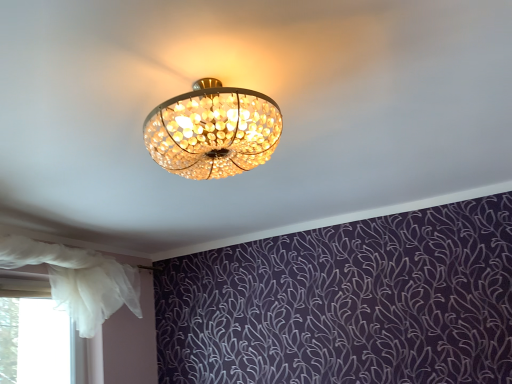
In order to face white sheer curtain at lower left, should I rotate leftwards or rightwards?

To face it directly, rotate left by 26.393 degrees.

Describe the element at coordinates (34, 342) in the screenshot. This screenshot has height=384, width=512. I see `white sheer curtain at lower left` at that location.

The image size is (512, 384). What are the coordinates of `white sheer curtain at lower left` in the screenshot? It's located at (34, 342).

Describe the element at coordinates (78, 280) in the screenshot. The image size is (512, 384). I see `white sheer curtain at left` at that location.

Locate an element on the screen. white sheer curtain at left is located at coordinates (78, 280).

What is the approximate height of white sheer curtain at left?

white sheer curtain at left is 27.05 inches tall.

Where is `white sheer curtain at lower left`? The height and width of the screenshot is (384, 512). white sheer curtain at lower left is located at coordinates (34, 342).

Is white sheer curtain at lower left at the right side of white sheer curtain at left?

In fact, white sheer curtain at lower left is to the left of white sheer curtain at left.

Which is behind, white sheer curtain at lower left or white sheer curtain at left?

white sheer curtain at lower left is further away from the camera.

Between point (56, 314) and point (83, 251), which one is positioned in front?

The point (83, 251) is closer.

From the image's perspective, is white sheer curtain at lower left over white sheer curtain at left?

No, from the image's perspective, white sheer curtain at lower left is not above white sheer curtain at left.

From a real-world perspective, which object stands above the other?

white sheer curtain at left, from a real-world perspective.

Considering the relative sizes of white sheer curtain at lower left and white sheer curtain at left in the image provided, is white sheer curtain at lower left wider than white sheer curtain at left?

In fact, white sheer curtain at lower left might be narrower than white sheer curtain at left.

Considering the sizes of objects white sheer curtain at lower left and white sheer curtain at left in the image provided, who is taller, white sheer curtain at lower left or white sheer curtain at left?

white sheer curtain at lower left is taller.

Based on the photo, does white sheer curtain at lower left have a smaller size compared to white sheer curtain at left?

Yes.

Would you say white sheer curtain at lower left is outside white sheer curtain at left?

Absolutely, white sheer curtain at lower left is external to white sheer curtain at left.

Is white sheer curtain at lower left not near white sheer curtain at left?

No, white sheer curtain at lower left is in close proximity to white sheer curtain at left.

Is white sheer curtain at lower left looking in the opposite direction of white sheer curtain at left?

white sheer curtain at lower left does not have its back to white sheer curtain at left.

Locate an element on the screen. The height and width of the screenshot is (384, 512). curtain in front of the white sheer curtain at lower left is located at coordinates (78, 280).

Which is more to the right, white sheer curtain at left or white sheer curtain at lower left?

Positioned to the right is white sheer curtain at left.

Which object is more forward, white sheer curtain at left or white sheer curtain at lower left?

white sheer curtain at left.

Considering the points (133, 278) and (13, 320), which point is in front, point (133, 278) or point (13, 320)?

The point (13, 320) is in front.

From the image's perspective, would you say white sheer curtain at left is shown under white sheer curtain at lower left?

No, from the image's perspective, white sheer curtain at left is not below white sheer curtain at lower left.

From a real-world perspective, is white sheer curtain at left physically located above or below white sheer curtain at lower left?

white sheer curtain at left is above white sheer curtain at lower left.

Considering the sizes of objects white sheer curtain at left and white sheer curtain at lower left in the image provided, who is wider, white sheer curtain at left or white sheer curtain at lower left?

With larger width is white sheer curtain at left.

Consider the image. Considering the relative sizes of white sheer curtain at left and white sheer curtain at lower left in the image provided, is white sheer curtain at left taller than white sheer curtain at lower left?

No.

Considering the sizes of objects white sheer curtain at left and white sheer curtain at lower left in the image provided, who is smaller, white sheer curtain at left or white sheer curtain at lower left?

white sheer curtain at lower left.

Is white sheer curtain at left not within white sheer curtain at lower left?

white sheer curtain at left lies outside white sheer curtain at lower left's area.

Is white sheer curtain at left directly adjacent to white sheer curtain at lower left?

They are not placed beside each other.

Is white sheer curtain at left facing away from white sheer curtain at lower left?

Yes.

How different are the orientations of white sheer curtain at left and white sheer curtain at lower left in degrees?

The angle between the facing direction of white sheer curtain at left and the facing direction of white sheer curtain at lower left is 1.38 degrees.

Image resolution: width=512 pixels, height=384 pixels. Find the location of `bay window below the white sheer curtain at left (from a real-world perspective)`. bay window below the white sheer curtain at left (from a real-world perspective) is located at coordinates (34, 342).

Identify the location of curtain above the white sheer curtain at lower left (from the image's perspective). The image size is (512, 384). (78, 280).

The width and height of the screenshot is (512, 384). What are the coordinates of `bay window that is under the white sheer curtain at left (from a real-world perspective)` in the screenshot? It's located at (34, 342).